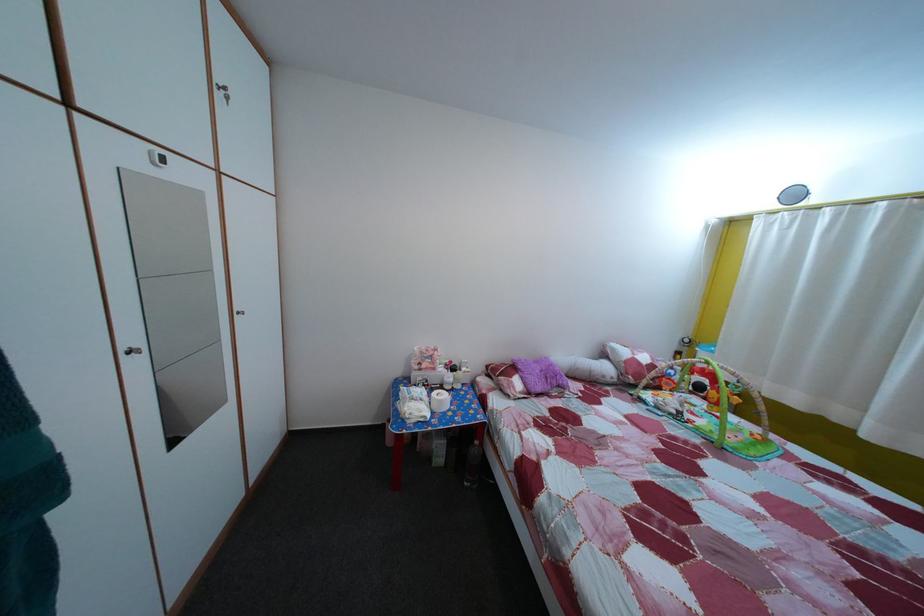
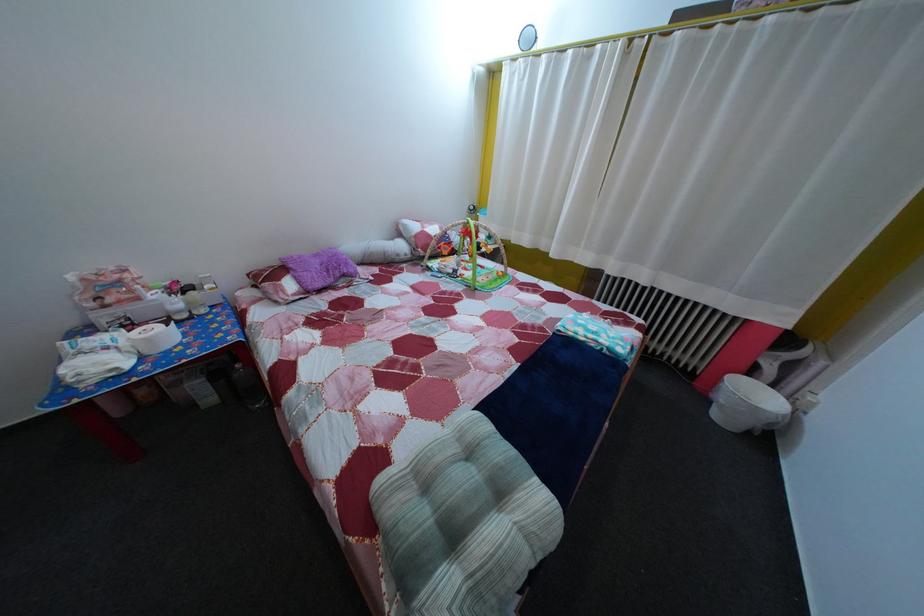
The first image is from the beginning of the video and the second image is from the end. How did the camera likely rotate when shooting the video?

The camera rotated toward right-down.